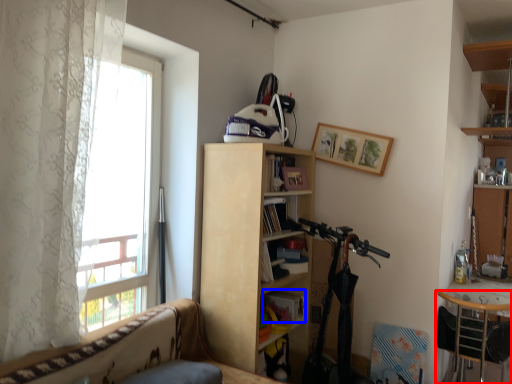
Question: Which object is further to the camera taking this photo, chair (highlighted by a red box) or book (highlighted by a blue box)?

Choices:
 (A) chair
 (B) book

Answer: (B)